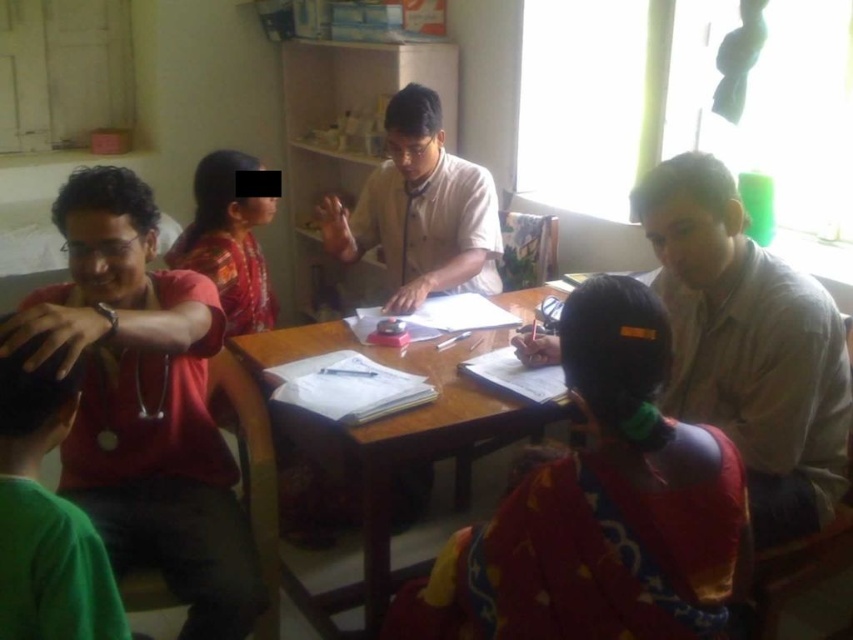
In the scene described, where is the multicolored fabric sari at center relative to the matte red shirt at left?

The multicolored fabric sari at center is to the right of the matte red shirt at left.

You are standing at the position of point (x=750, y=374) and want to walk towards the position of point (x=190, y=540). Considering the layout of the room described, will you have to move forward or backward to reach your destination?

Since point (x=190, y=540) is in front of point (x=750, y=374), you will need to move forward to reach it.